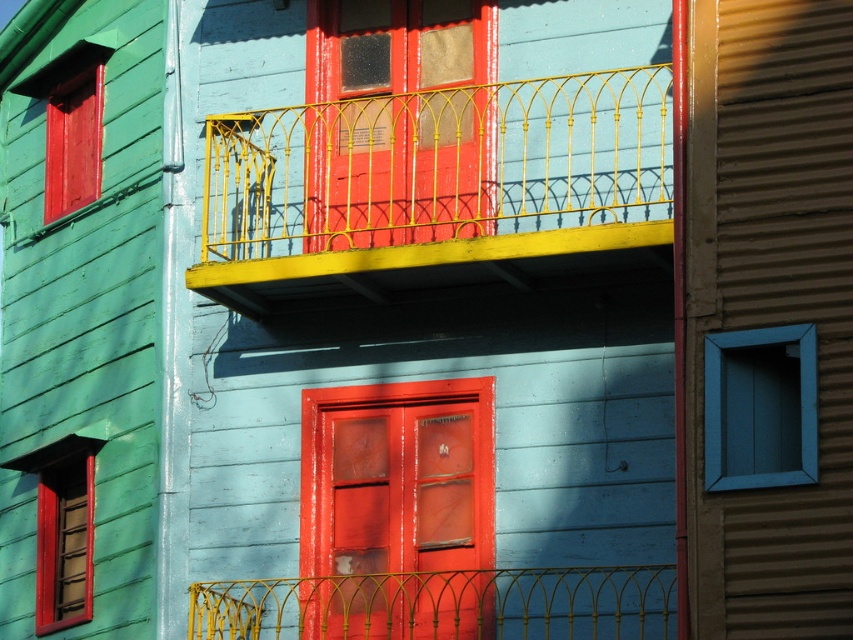
Question: Which object appears farthest from the camera in this image?

Choices:
 (A) blue wood window at right
 (B) yellow wire mesh at center
 (C) matte wood door at center

Answer: (C)

Question: Can you confirm if yellow wrought iron balcony at upper center is positioned to the right of matte wood door at center?

Choices:
 (A) yes
 (B) no

Answer: (A)

Question: Which object appears farthest from the camera in this image?

Choices:
 (A) matte wood door at center
 (B) blue wood window at right

Answer: (A)

Question: Estimate the real-world distances between objects in this image. Which object is farther from the yellow wire mesh at center?

Choices:
 (A) glossy wood door at center
 (B) yellow wrought iron balcony at upper center
 (C) blue wood window at right
 (D) matte wood door at center

Answer: (C)

Question: Can you confirm if yellow wrought iron balcony at upper center is positioned below blue wood window at right?

Choices:
 (A) no
 (B) yes

Answer: (B)

Question: Can you confirm if matte wood door at center is thinner than yellow wire mesh at center?

Choices:
 (A) yes
 (B) no

Answer: (A)